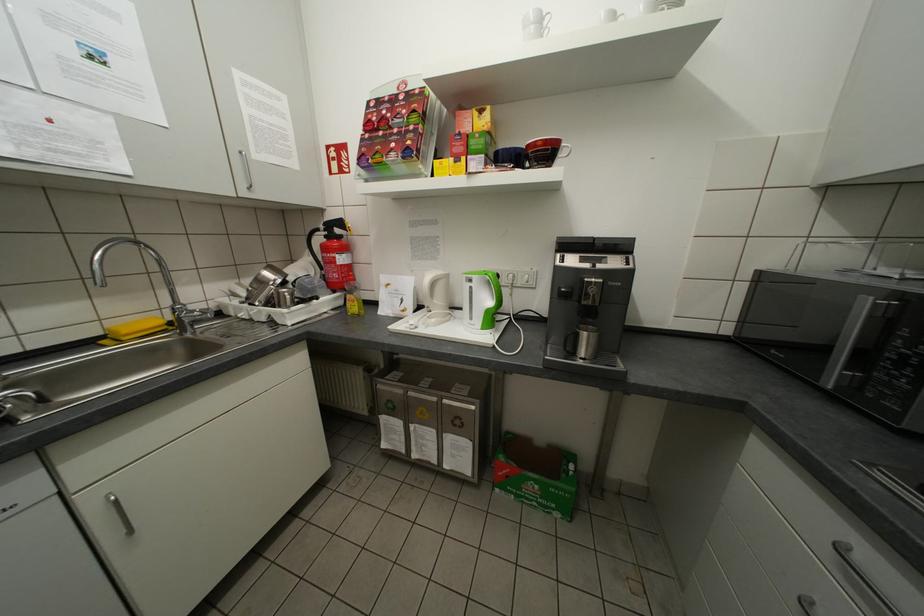
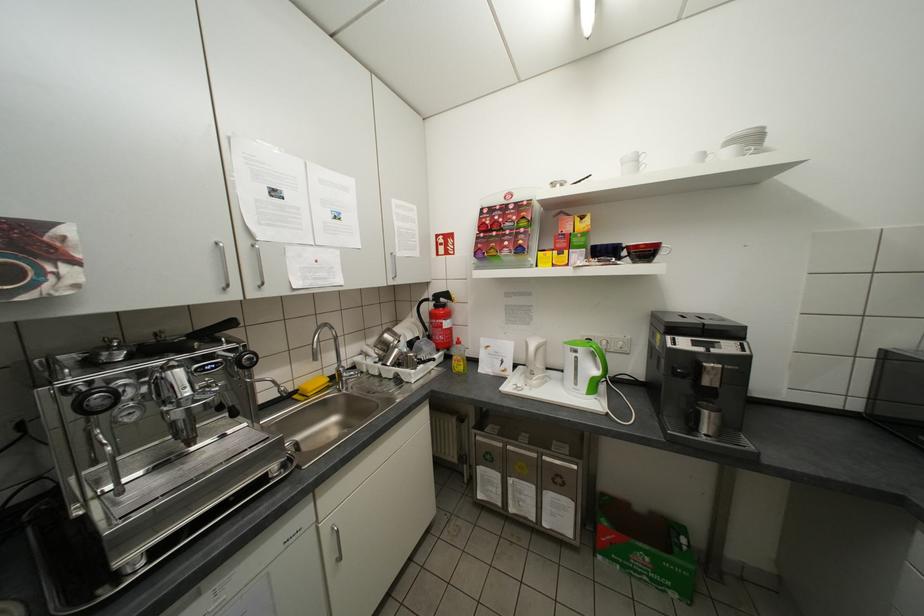
The point at (x=548, y=144) is marked in the first image. Where is the corresponding point in the second image?

(650, 246)